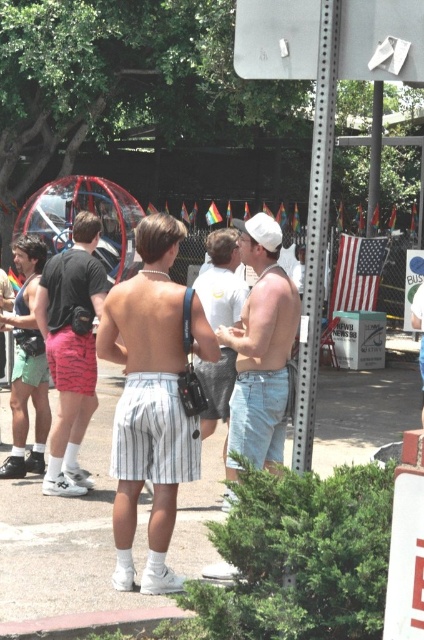
Question: Can you confirm if matte green shorts at left is positioned above white cotton shirt at center?

Choices:
 (A) no
 (B) yes

Answer: (A)

Question: Does white striped shorts at center come in front of matte pink shorts at left?

Choices:
 (A) yes
 (B) no

Answer: (A)

Question: Which of the following is the closest to the observer?

Choices:
 (A) (251, 321)
 (B) (209, 410)
 (C) (423, 339)
 (D) (128, 400)

Answer: (D)

Question: Which point is farther to the camera?

Choices:
 (A) matte white shorts at center
 (B) matte green shorts at left
 (C) white cotton shirt at center

Answer: (B)

Question: Does white striped shorts at center lie in front of blue denim shorts at center?

Choices:
 (A) no
 (B) yes

Answer: (B)

Question: Which of the following is the farthest from the observer?

Choices:
 (A) white cotton shirt at center
 (B) metallic sign at upper center

Answer: (A)